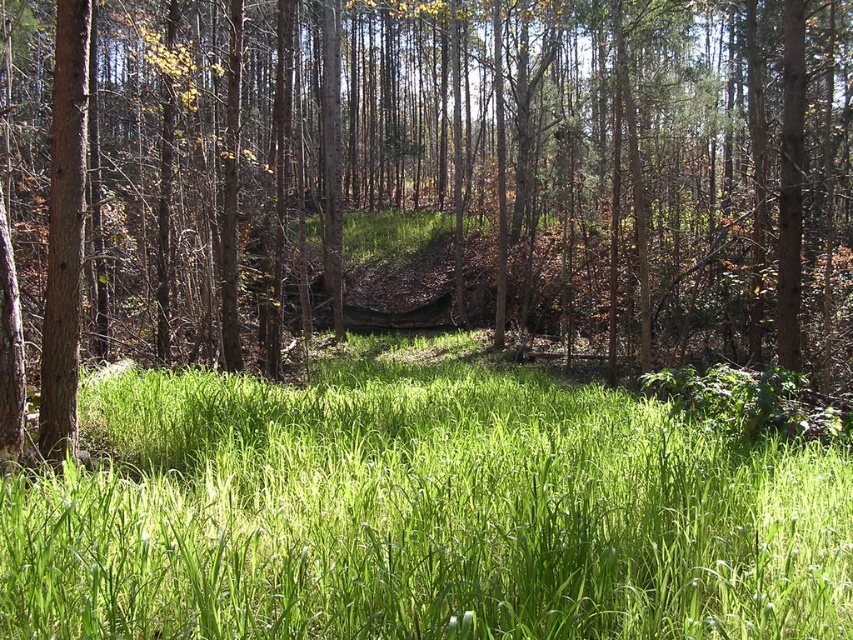
Is brown wood tree at center positioned in front of green grassy at center?

No, it is not.

Can you confirm if brown wood tree at center is thinner than green grassy at center?

No.

Is point (585, 163) positioned after point (583, 394)?

Yes.

You are a GUI agent. You are given a task and a screenshot of the screen. Output one action in this format:
    pyautogui.click(x=<x>, y=<y>)
    Task: Click on the brown wood tree at center
    The width and height of the screenshot is (853, 640).
    Given the screenshot: What is the action you would take?
    pyautogui.click(x=430, y=186)